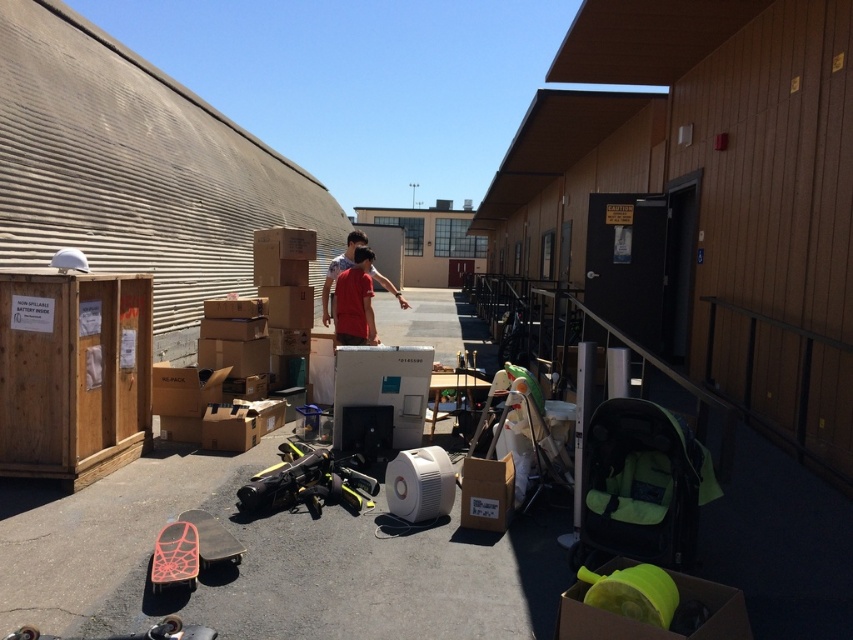
Question: Which object is positioned closest to the matte red shirt at center?

Choices:
 (A) brown cardboard box at center
 (B) matte green plastic bucket at lower right

Answer: (A)

Question: Is matte green plastic bucket at lower right to the left of matte red shirt at center from the viewer's perspective?

Choices:
 (A) yes
 (B) no

Answer: (B)

Question: Which object is closer to the camera taking this photo?

Choices:
 (A) brown cardboard box at center
 (B) matte red shirt at center

Answer: (A)

Question: In this image, where is matte green plastic bucket at lower right located relative to brown cardboard box at center?

Choices:
 (A) left
 (B) right

Answer: (B)

Question: Which point is farther from the camera taking this photo?

Choices:
 (A) (677, 577)
 (B) (485, 518)

Answer: (B)

Question: From the image, what is the correct spatial relationship of matte green plastic bucket at lower right in relation to matte red shirt at center?

Choices:
 (A) below
 (B) above

Answer: (A)